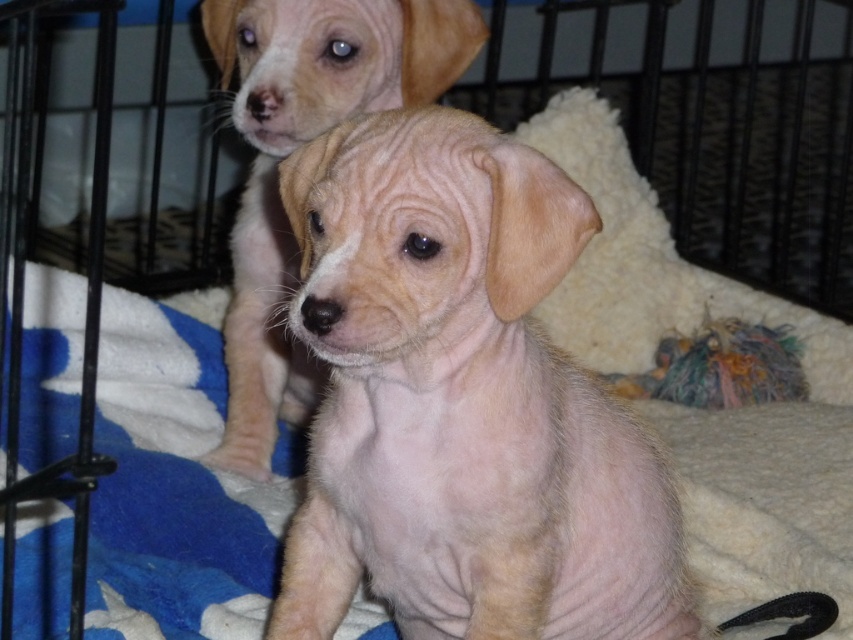
Measure the distance between point (183, 452) and camera.

4.75 feet

Who is positioned more to the left, white fleece blanket at center or light brown fur at center?

From the viewer's perspective, white fleece blanket at center appears more on the left side.

Between point (845, 547) and point (248, 74), which one is positioned behind?

The point (248, 74) is more distant.

Identify the location of white fleece blanket at center. This screenshot has width=853, height=640. (175, 486).

Which is more to the left, light beige fur at center or white fleece blanket at center?

From the viewer's perspective, white fleece blanket at center appears more on the left side.

Is point (614, 467) in front of point (677, 452)?

That is True.

I want to click on light beige fur at center, so click(461, 403).

I want to click on light beige fur at center, so click(x=461, y=403).

Is point (436, 236) more distant than point (390, 102)?

No, it is not.

Does light beige fur at center appear on the left side of light brown fur at center?

In fact, light beige fur at center is to the right of light brown fur at center.

Is point (338, 445) in front of point (207, 460)?

Yes, point (338, 445) is in front of point (207, 460).

Locate an element on the screen. Image resolution: width=853 pixels, height=640 pixels. light beige fur at center is located at coordinates (461, 403).